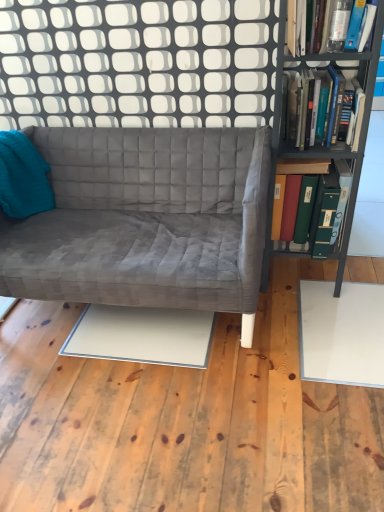
Question: Would you consider hardcover books at right, which is the 2th book from bottom to top, to be distant from transparent glass door at upper center?

Choices:
 (A) no
 (B) yes

Answer: (A)

Question: From a real-world perspective, is hardcover books at right, which is the 2th book from bottom to top, below transparent glass door at upper center?

Choices:
 (A) yes
 (B) no

Answer: (A)

Question: Can you confirm if hardcover books at right, which is the 2th book from bottom to top, is bigger than transparent glass door at upper center?

Choices:
 (A) yes
 (B) no

Answer: (B)

Question: Is hardcover books at right, which is the 2th book from bottom to top, positioned with its back to transparent glass door at upper center?

Choices:
 (A) yes
 (B) no

Answer: (A)

Question: Is transparent glass door at upper center located within hardcover books at right, which ranks as the second book in top-to-bottom order?

Choices:
 (A) no
 (B) yes

Answer: (A)

Question: Based on their positions, is metallic gray bookcase at right located to the left or right of transparent glass door at upper center?

Choices:
 (A) left
 (B) right

Answer: (B)

Question: Is metallic gray bookcase at right wider or thinner than transparent glass door at upper center?

Choices:
 (A) wide
 (B) thin

Answer: (A)

Question: Based on their sizes in the image, would you say metallic gray bookcase at right is bigger or smaller than transparent glass door at upper center?

Choices:
 (A) big
 (B) small

Answer: (A)

Question: From the image's perspective, is metallic gray bookcase at right positioned above or below transparent glass door at upper center?

Choices:
 (A) below
 (B) above

Answer: (A)

Question: From a real-world perspective, is teal fabric throw pillow at left positioned above or below velvet gray couch at center?

Choices:
 (A) above
 (B) below

Answer: (A)

Question: Is teal fabric throw pillow at left in front of or behind velvet gray couch at center in the image?

Choices:
 (A) front
 (B) behind

Answer: (B)

Question: Is teal fabric throw pillow at left taller or shorter than velvet gray couch at center?

Choices:
 (A) short
 (B) tall

Answer: (A)

Question: Would you say teal fabric throw pillow at left is to the left or to the right of velvet gray couch at center in the picture?

Choices:
 (A) left
 (B) right

Answer: (A)

Question: Considering the positions of transparent glass door at upper center and teal fabric throw pillow at left in the image, is transparent glass door at upper center wider or thinner than teal fabric throw pillow at left?

Choices:
 (A) wide
 (B) thin

Answer: (B)

Question: Based on their positions, is transparent glass door at upper center located to the left or right of teal fabric throw pillow at left?

Choices:
 (A) left
 (B) right

Answer: (B)